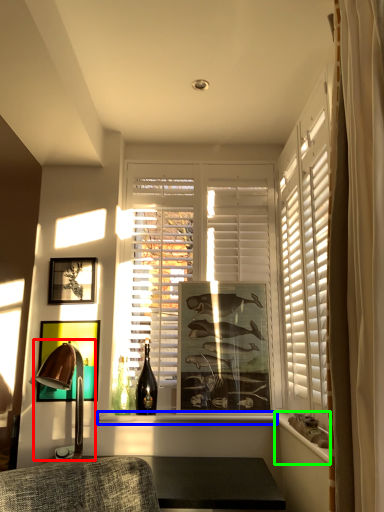
Question: Considering the real-world distances, which object is closest to table lamp (highlighted by a red box)? window sill (highlighted by a blue box) or ledge (highlighted by a green box).

Choices:
 (A) window sill
 (B) ledge

Answer: (A)